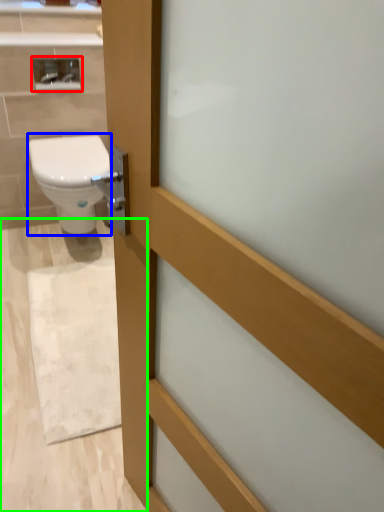
Question: Considering the real-world distances, which object is farthest from medicine cabinet (highlighted by a red box)? bidet (highlighted by a blue box) or plain (highlighted by a green box)?

Choices:
 (A) bidet
 (B) plain

Answer: (B)